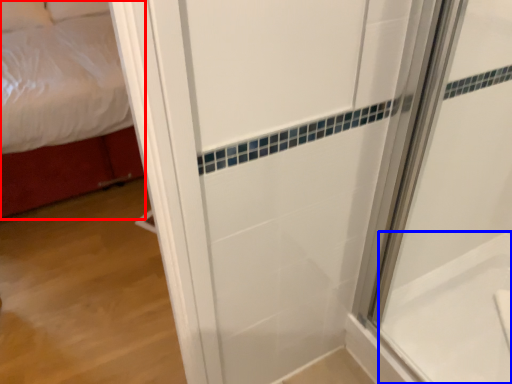
Question: Which point is further to the camera, bed (highlighted by a red box) or bath (highlighted by a blue box)?

Choices:
 (A) bed
 (B) bath

Answer: (A)